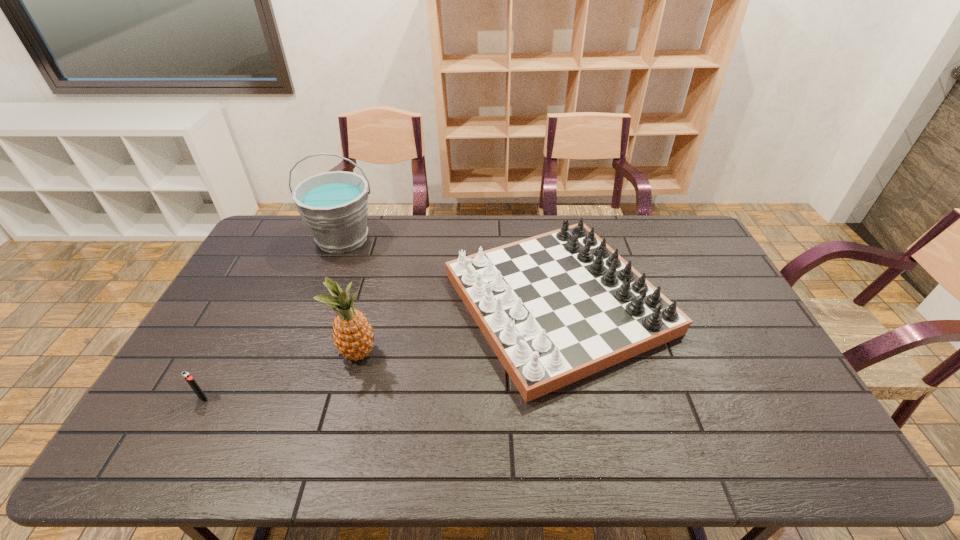
Locate an element on the screen. bucket is located at coordinates (334, 205).

Where is `the third shortest object`? The height and width of the screenshot is (540, 960). the third shortest object is located at coordinates (353, 335).

Where is `gameboard`? gameboard is located at coordinates (557, 307).

At what (x,y) coordinates should I click in order to perform the action: click on the third tallest object. Please return your answer as a coordinate pair (x, y). Looking at the image, I should click on (557, 307).

Where is `the leftmost object`? the leftmost object is located at coordinates (190, 380).

Where is `the shortest object`? the shortest object is located at coordinates (190, 380).

This screenshot has height=540, width=960. I want to click on vacant region located 0.190m on the front of the bucket, so click(320, 298).

The height and width of the screenshot is (540, 960). I want to click on free region located 0.280m on the right of the third shortest object, so click(x=477, y=353).

Identify the location of vacant space located 0.060m on the back of the gameboard. (544, 226).

Identify the location of blank space located on the front of the shortest object. (180, 442).